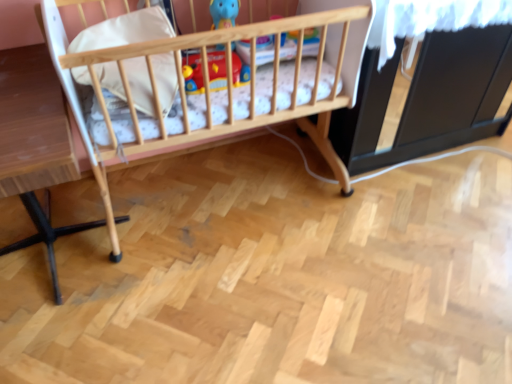
This screenshot has height=384, width=512. I want to click on light brown wooden table at left, so click(35, 143).

What is the approximate width of light brown wooden table at left?

light brown wooden table at left is 71.99 centimeters in width.

What do you see at coordinates (224, 13) in the screenshot?
I see `matte plastic toy at center` at bounding box center [224, 13].

What do you see at coordinates (124, 30) in the screenshot?
I see `white soft pillow at upper left` at bounding box center [124, 30].

Find the location of a particular element. This screenshot has width=512, height=384. light brown wooden table at left is located at coordinates (35, 143).

Who is smaller, matte plastic toy at center or wooden crib at center?

With smaller size is matte plastic toy at center.

Which of these two, matte plastic toy at center or wooden crib at center, stands taller?

wooden crib at center.

From a real-world perspective, is matte plastic toy at center above or below wooden crib at center?

In terms of real-world spatial position, matte plastic toy at center is above wooden crib at center.

Between matte plastic toy at center and wooden crib at center, which one is positioned behind?

matte plastic toy at center is further from the camera.

Who is smaller, wooden crib at center or white soft pillow at upper left?

white soft pillow at upper left is smaller.

From a real-world perspective, which is physically below, wooden crib at center or white soft pillow at upper left?

wooden crib at center is physically lower.

Relative to white soft pillow at upper left, is wooden crib at center in front or behind?

wooden crib at center is positioned closer to the viewer than white soft pillow at upper left.

How distant is wooden crib at center from white soft pillow at upper left?

wooden crib at center is 6.45 inches away from white soft pillow at upper left.

In the image, is matte plastic toy at center positioned in front of or behind white soft pillow at upper left?

matte plastic toy at center is positioned farther from the viewer than white soft pillow at upper left.

Can you confirm if matte plastic toy at center is smaller than white soft pillow at upper left?

Correct, matte plastic toy at center occupies less space than white soft pillow at upper left.

Consider the image. Considering the positions of objects matte plastic toy at center and white soft pillow at upper left in the image provided, who is more to the left, matte plastic toy at center or white soft pillow at upper left?

Positioned to the left is white soft pillow at upper left.

Find the location of a particular element. pillow to the left of wooden crib at center is located at coordinates (124, 30).

From the image's perspective, is white soft pillow at upper left above or below wooden crib at center?

white soft pillow at upper left is situated higher than wooden crib at center in the image.

Considering the relative sizes of white soft pillow at upper left and wooden crib at center in the image provided, is white soft pillow at upper left thinner than wooden crib at center?

Correct, the width of white soft pillow at upper left is less than that of wooden crib at center.

Considering the sizes of light brown wooden table at left and wooden crib at center in the image, is light brown wooden table at left taller or shorter than wooden crib at center?

light brown wooden table at left is shorter than wooden crib at center.

From a real-world perspective, is light brown wooden table at left below wooden crib at center?

Yes.

Is light brown wooden table at left facing away from wooden crib at center?

No.

Where is `table on the left of wooden crib at center`? table on the left of wooden crib at center is located at coordinates (35, 143).

Which of these two, white soft pillow at upper left or matte plastic toy at center, stands taller?

Standing taller between the two is matte plastic toy at center.

Can you see white soft pillow at upper left touching matte plastic toy at center?

No, white soft pillow at upper left is not beside matte plastic toy at center.

Is white soft pillow at upper left aimed at matte plastic toy at center?

No.

From the image's perspective, which is above, white soft pillow at upper left or matte plastic toy at center?

matte plastic toy at center.

In the image, is light brown wooden table at left positioned in front of or behind matte plastic toy at center?

Visually, light brown wooden table at left is located in front of matte plastic toy at center.

Who is shorter, light brown wooden table at left or matte plastic toy at center?

Standing shorter between the two is matte plastic toy at center.

From the image's perspective, is light brown wooden table at left located above or below matte plastic toy at center?

Based on their image positions, light brown wooden table at left is located beneath matte plastic toy at center.

Does point (51, 238) appear closer or farther from the camera than point (224, 3)?

Point (51, 238).

What are the coordinates of `toy above the wooden crib at center (from the image's perspective)` in the screenshot? It's located at (x=224, y=13).

At what (x,y) coordinates should I click in order to perform the action: click on pillow above the wooden crib at center (from a real-world perspective). Please return your answer as a coordinate pair (x, y). The height and width of the screenshot is (384, 512). Looking at the image, I should click on (124, 30).

Considering their positions, is white soft pillow at upper left positioned closer to wooden crib at center than matte plastic toy at center?

The object closer to wooden crib at center is white soft pillow at upper left.

When comparing their distances from wooden crib at center, does white soft pillow at upper left or light brown wooden table at left seem further?

light brown wooden table at left is positioned further to the anchor wooden crib at center.

Which object lies nearer to the anchor point white soft pillow at upper left, light brown wooden table at left or matte plastic toy at center?

light brown wooden table at left.

Estimate the real-world distances between objects in this image. Which object is closer to wooden crib at center, light brown wooden table at left or white soft pillow at upper left?

white soft pillow at upper left is closer to wooden crib at center.

Considering their positions, is wooden crib at center positioned further to light brown wooden table at left than matte plastic toy at center?

matte plastic toy at center.

Based on their spatial positions, is light brown wooden table at left or wooden crib at center further from matte plastic toy at center?

light brown wooden table at left lies further to matte plastic toy at center than the other object.

Looking at the image, which one is located further to matte plastic toy at center, wooden crib at center or light brown wooden table at left?

light brown wooden table at left is positioned further to the anchor matte plastic toy at center.

When comparing their distances from wooden crib at center, does matte plastic toy at center or white soft pillow at upper left seem closer?

white soft pillow at upper left is closer to wooden crib at center.

The width and height of the screenshot is (512, 384). I want to click on infant bed located between light brown wooden table at left and matte plastic toy at center in the left-right direction, so click(x=225, y=80).

Image resolution: width=512 pixels, height=384 pixels. I want to click on pillow located between light brown wooden table at left and matte plastic toy at center in the left-right direction, so click(124, 30).

In order to click on pillow between wooden crib at center and matte plastic toy at center in the front-back direction in this screenshot , I will do `click(124, 30)`.

The height and width of the screenshot is (384, 512). I want to click on pillow between light brown wooden table at left and wooden crib at center in the horizontal direction, so click(x=124, y=30).